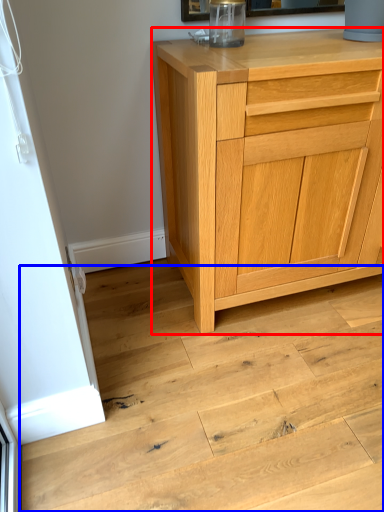
Question: Which object is closer to the camera taking this photo, chest of drawers (highlighted by a red box) or stair (highlighted by a blue box)?

Choices:
 (A) chest of drawers
 (B) stair

Answer: (B)